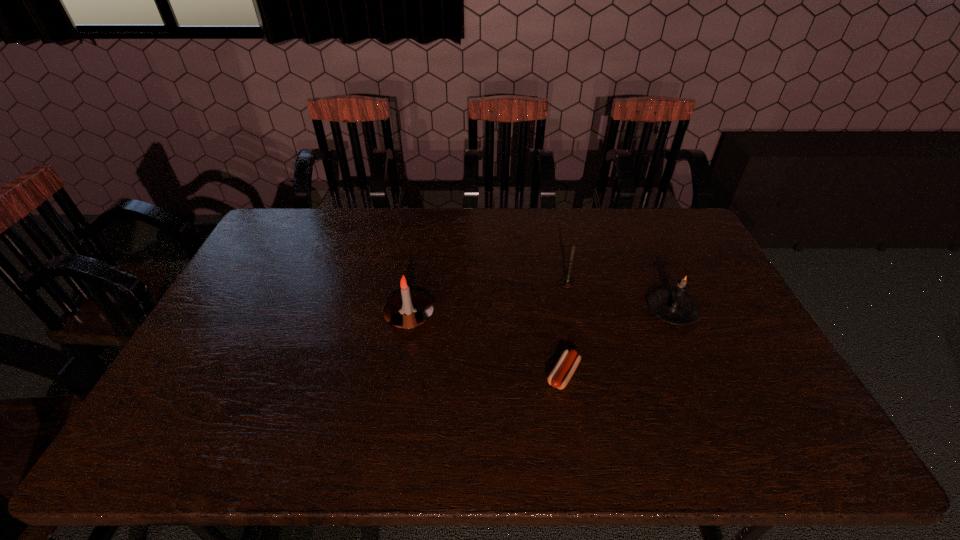
The image size is (960, 540). Identify the location of the leftmost object. (407, 310).

The width and height of the screenshot is (960, 540). Find the location of `the second candle from right to left`. the second candle from right to left is located at coordinates (567, 282).

At what (x,y) coordinates should I click in order to perform the action: click on the farthest candle. Please return your answer as a coordinate pair (x, y). Looking at the image, I should click on (567, 282).

This screenshot has height=540, width=960. What are the coordinates of `the rightmost object` in the screenshot? It's located at (674, 306).

The image size is (960, 540). Find the location of `the shortest object`. the shortest object is located at coordinates (560, 375).

Where is `sausage`? sausage is located at coordinates (560, 375).

Find the location of a particular element. Image resolution: width=960 pixels, height=540 pixels. vacant space located on the right of the leftmost candle is located at coordinates (569, 316).

This screenshot has width=960, height=540. What are the coordinates of `vacant region located on the left of the second candle from left to right` in the screenshot? It's located at (519, 283).

You are a GUI agent. You are given a task and a screenshot of the screen. Output one action in this format:
    pyautogui.click(x=<x>, y=<y>)
    Task: Click on the vacant space located on the back of the rightmost candle
    The width and height of the screenshot is (960, 540).
    Given the screenshot: What is the action you would take?
    pyautogui.click(x=637, y=233)

You are a GUI agent. You are given a task and a screenshot of the screen. Output one action in this format:
    pyautogui.click(x=<x>, y=<y>)
    Task: Click on the free space located on the right of the nearest object
    The height and width of the screenshot is (540, 960).
    Given the screenshot: What is the action you would take?
    pyautogui.click(x=708, y=374)